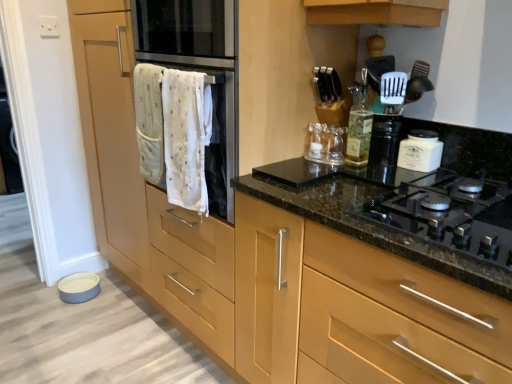
Question: From the image's perspective, relative to white cloth oven at center, is white quilted towel at center, which is counted as the first bath towel, starting from the left, above or below?

Choices:
 (A) below
 (B) above

Answer: (B)

Question: Choose the correct answer: Is white quilted towel at center, which is counted as the first bath towel, starting from the left, inside white cloth oven at center or outside it?

Choices:
 (A) inside
 (B) outside

Answer: (A)

Question: Estimate the real-world distances between objects in this image. Which object is farther from the black glass gas stove at center right?

Choices:
 (A) white cloth oven at center
 (B) white cotton bath towel at center, the 1th bath towel when ordered from right to left
 (C) translucent glass bottle at upper center
 (D) matte wood cabinet at center
 (E) white quilted towel at center, the second bath towel when ordered from right to left

Answer: (E)

Question: Which object is positioned farthest from the white quilted towel at center, which is counted as the first bath towel, starting from the left?

Choices:
 (A) white cotton bath towel at center, which appears as the 2th bath towel when viewed from the left
 (B) matte wood cabinet at center
 (C) white matte jar at upper right
 (D) translucent glass bottle at upper center
 (E) white cloth oven at center

Answer: (C)